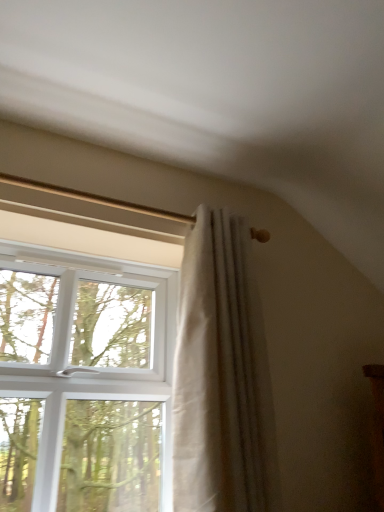
Question: Is white textured curtain at center positioned beyond the bounds of white plastic window at upper left?

Choices:
 (A) yes
 (B) no

Answer: (A)

Question: Is white textured curtain at center touching white plastic window at upper left?

Choices:
 (A) yes
 (B) no

Answer: (B)

Question: Is white textured curtain at center closer to the viewer compared to white plastic window at upper left?

Choices:
 (A) no
 (B) yes

Answer: (A)

Question: Considering the relative sizes of white textured curtain at center and white plastic window at upper left in the image provided, is white textured curtain at center wider than white plastic window at upper left?

Choices:
 (A) yes
 (B) no

Answer: (B)

Question: Could white plastic window at upper left be considered to be inside white textured curtain at center?

Choices:
 (A) no
 (B) yes

Answer: (A)

Question: Are white textured curtain at center and white plastic window at upper left located far from each other?

Choices:
 (A) yes
 (B) no

Answer: (B)

Question: Considering the relative sizes of white plastic window at upper left and white textured curtain at center in the image provided, is white plastic window at upper left thinner than white textured curtain at center?

Choices:
 (A) yes
 (B) no

Answer: (B)

Question: Can you confirm if white plastic window at upper left is wider than white textured curtain at center?

Choices:
 (A) no
 (B) yes

Answer: (B)

Question: Can you confirm if white plastic window at upper left is shorter than white textured curtain at center?

Choices:
 (A) yes
 (B) no

Answer: (A)

Question: From a real-world perspective, is white plastic window at upper left below white textured curtain at center?

Choices:
 (A) yes
 (B) no

Answer: (A)

Question: From the image's perspective, would you say white plastic window at upper left is positioned over white textured curtain at center?

Choices:
 (A) no
 (B) yes

Answer: (A)

Question: From a real-world perspective, is white plastic window at upper left on top of white textured curtain at center?

Choices:
 (A) yes
 (B) no

Answer: (B)

Question: From the image's perspective, is white plastic window at upper left positioned above or below white textured curtain at center?

Choices:
 (A) above
 (B) below

Answer: (B)